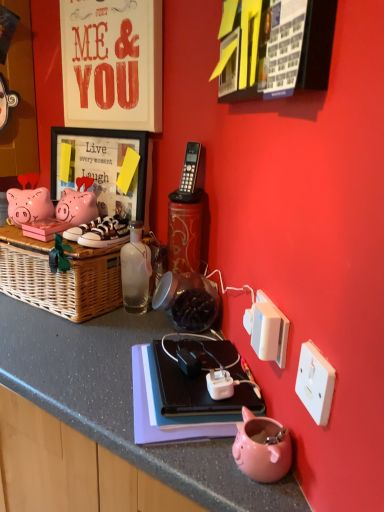
Question: From a real-world perspective, is matte pink piggy bank at left located beneath white plastic power outlet at lower right, which appears as the 1th power outlet when viewed from the left?

Choices:
 (A) no
 (B) yes

Answer: (A)

Question: From a real-world perspective, is matte pink piggy bank at left over white plastic power outlet at lower right, which is counted as the 2th power outlet, starting from the front?

Choices:
 (A) yes
 (B) no

Answer: (A)

Question: Does matte pink piggy bank at left have a lesser height compared to white plastic power outlet at lower right, which ranks as the first power outlet in back-to-front order?

Choices:
 (A) yes
 (B) no

Answer: (B)

Question: From the image's perspective, would you say matte pink piggy bank at left is positioned over white plastic power outlet at lower right, which appears as the 2th power outlet when viewed from the right?

Choices:
 (A) yes
 (B) no

Answer: (A)

Question: Is matte pink piggy bank at left behind white plastic power outlet at lower right, which is counted as the 2th power outlet, starting from the front?

Choices:
 (A) yes
 (B) no

Answer: (A)

Question: From the image's perspective, is matte pink piggy bank at left below white plastic power outlet at lower right, which appears as the 1th power outlet when viewed from the left?

Choices:
 (A) no
 (B) yes

Answer: (A)

Question: From the image's perspective, is matte pink piggy bank at left beneath white plastic power outlet at lower right, which is counted as the 2th power outlet, starting from the left?

Choices:
 (A) no
 (B) yes

Answer: (A)

Question: Does matte pink piggy bank at left contain white plastic power outlet at lower right, which is counted as the 2th power outlet, starting from the left?

Choices:
 (A) no
 (B) yes

Answer: (A)

Question: Does matte pink piggy bank at left have a lesser width compared to white plastic power outlet at lower right, the first power outlet when ordered from right to left?

Choices:
 (A) yes
 (B) no

Answer: (B)

Question: Does matte pink piggy bank at left come in front of white plastic power outlet at lower right, the first power outlet when ordered from right to left?

Choices:
 (A) no
 (B) yes

Answer: (A)

Question: Are matte pink piggy bank at left and white plastic power outlet at lower right, which is counted as the 2th power outlet, starting from the left, located far from each other?

Choices:
 (A) yes
 (B) no

Answer: (A)

Question: Is matte pink piggy bank at left bigger than white plastic power outlet at lower right, marked as the second power outlet in a back-to-front arrangement?

Choices:
 (A) no
 (B) yes

Answer: (B)

Question: Considering the relative sizes of white plastic power plugs and sockets at right and transparent glass bottle at center in the image provided, is white plastic power plugs and sockets at right bigger than transparent glass bottle at center?

Choices:
 (A) no
 (B) yes

Answer: (A)